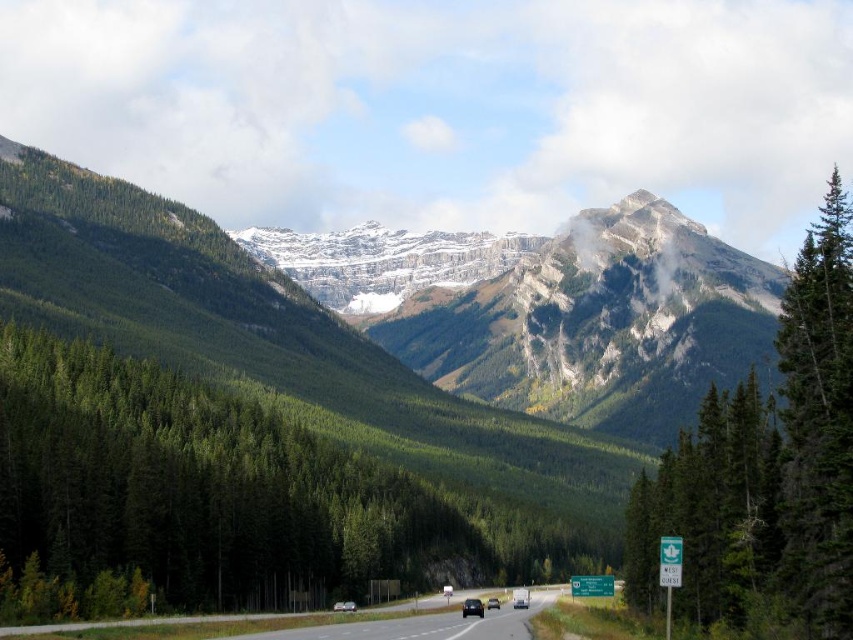
Question: Which object is closer to the camera taking this photo?

Choices:
 (A) green forested mountain range at upper center
 (B) green textured tree at right

Answer: (B)

Question: Considering the relative positions of green textured pine tree at right and green textured tree at right in the image provided, where is green textured pine tree at right located with respect to green textured tree at right?

Choices:
 (A) above
 (B) below

Answer: (A)

Question: Which point is farther to the camera?

Choices:
 (A) (689, 272)
 (B) (798, 323)

Answer: (A)

Question: Considering the real-world distances, which object is farthest from the green textured tree at right?

Choices:
 (A) asphalt road at center
 (B) green textured pine tree at right
 (C) green textured tree at upper right
 (D) green forested mountain range at upper center

Answer: (D)

Question: Does green forested mountain range at upper center lie behind asphalt road at center?

Choices:
 (A) no
 (B) yes

Answer: (B)

Question: Does green forested mountain range at upper center appear on the right side of asphalt road at center?

Choices:
 (A) no
 (B) yes

Answer: (A)